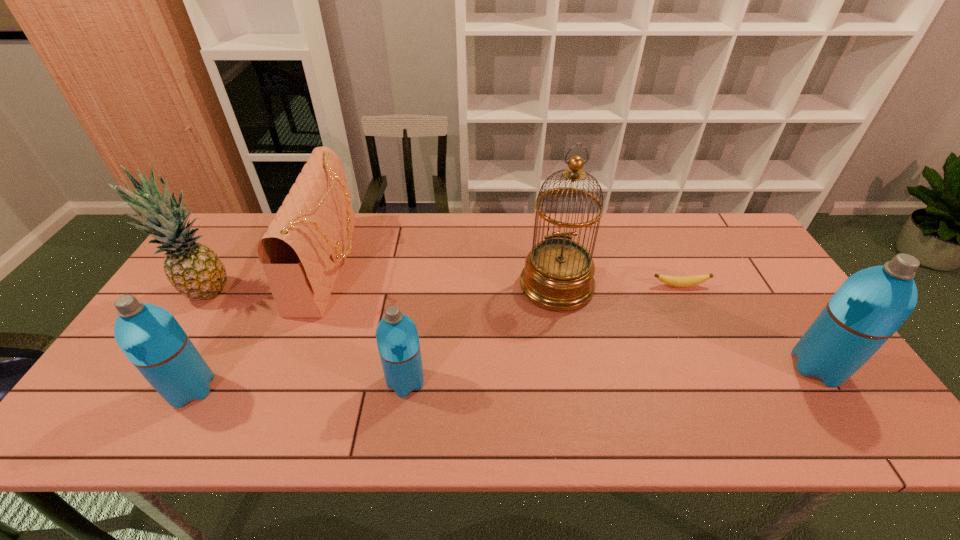
Locate an element on the screen. vacant space located 0.360m on the left of the second thermos bottle from right to left is located at coordinates (236, 381).

Where is `vacant region located 0.120m on the back of the rightmost object`? The width and height of the screenshot is (960, 540). vacant region located 0.120m on the back of the rightmost object is located at coordinates click(x=781, y=312).

At what (x,y) coordinates should I click in order to perform the action: click on vacant area situated on the front-facing side of the handbag. Please return your answer as a coordinate pair (x, y). This screenshot has height=540, width=960. Looking at the image, I should click on (430, 264).

I want to click on free space located 0.260m with an open door on the birdcage, so click(x=577, y=396).

The width and height of the screenshot is (960, 540). Find the location of `free location located 0.170m on the right of the banana`. free location located 0.170m on the right of the banana is located at coordinates (766, 286).

Identify the location of vacant area situated 0.050m on the front of the pineapple. (185, 323).

Find the location of a particular element. object positioned at the far edge is located at coordinates (301, 253).

This screenshot has width=960, height=540. I want to click on thermos bottle that is at the left edge, so (x=151, y=338).

This screenshot has height=540, width=960. In order to click on pineapple at the left edge in this screenshot , I will do `click(193, 269)`.

You are a GUI agent. You are given a task and a screenshot of the screen. Output one action in this format:
    pyautogui.click(x=<x>, y=<y>)
    Task: Click on the object that is positioned at the right edge
    The height and width of the screenshot is (540, 960).
    Given the screenshot: What is the action you would take?
    pyautogui.click(x=870, y=306)